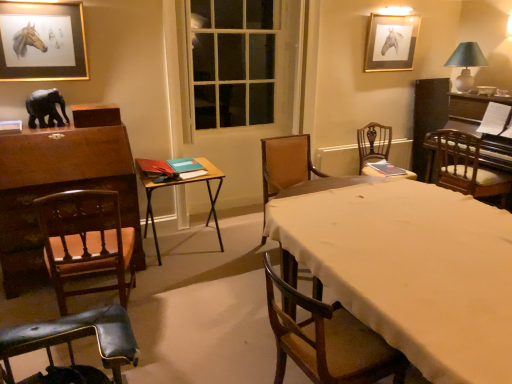
Question: Looking at their shapes, would you say wooden chair at center, the fourth chair in the right-to-left sequence, is wider or thinner than black matte elephant at left?

Choices:
 (A) wide
 (B) thin

Answer: (A)

Question: From the image's perspective, is wooden chair at center, the fourth chair in the right-to-left sequence, located above or below black matte elephant at left?

Choices:
 (A) below
 (B) above

Answer: (A)

Question: Estimate the real-world distances between objects in this image. Which object is closer to the gold-framed picture at upper right, marked as the 1th picture frame in a back-to-front arrangement?

Choices:
 (A) white cloth-covered table at center, arranged as the second table when viewed from the left
 (B) wooden folding table at center, acting as the 1th table starting from the left
 (C) brown fabric chair at center, the 4th chair positioned from the left
 (D) wooden chair at center, the 3th chair positioned from the left
 (E) wooden chair at center, the fifth chair from the left

Answer: (E)

Question: Which object is positioned farthest from the wooden chair at center, which is counted as the 2th chair, starting from the right?

Choices:
 (A) green fabric lampshade at upper right
 (B) leather cushioned chair at lower left, which appears as the 5th chair when viewed from the right
 (C) white cloth-covered table at center, arranged as the second table when viewed from the left
 (D) wooden folding table at center, acting as the 1th table starting from the left
 (E) wooden chair at center, the fourth chair in the right-to-left sequence

Answer: (B)